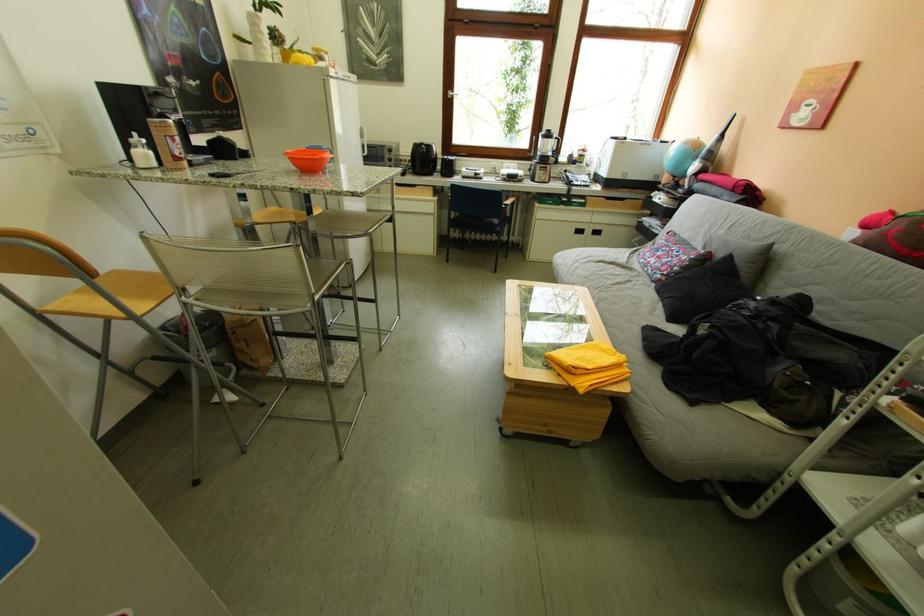
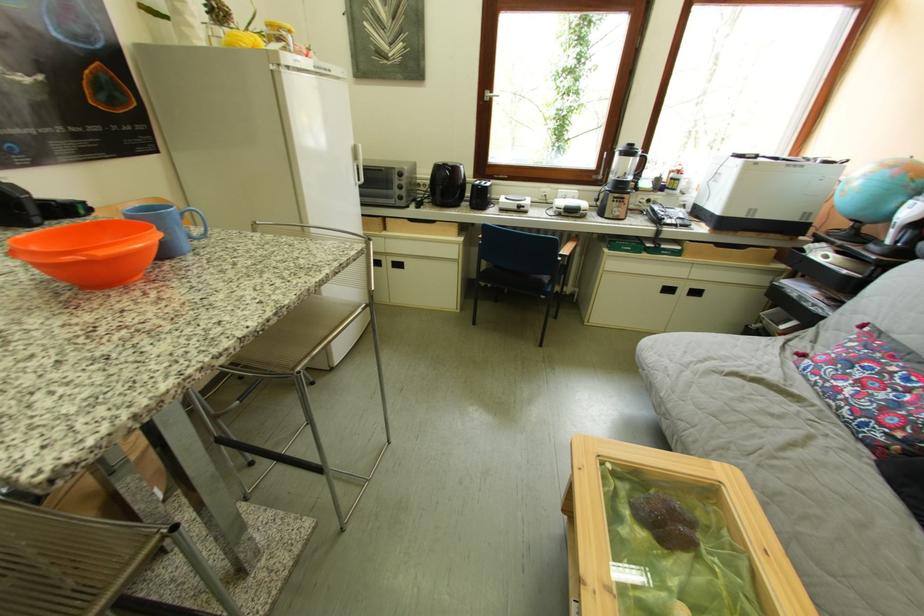
Where in the second image is the point corresponding to point (430, 150) from the first image?

(451, 171)